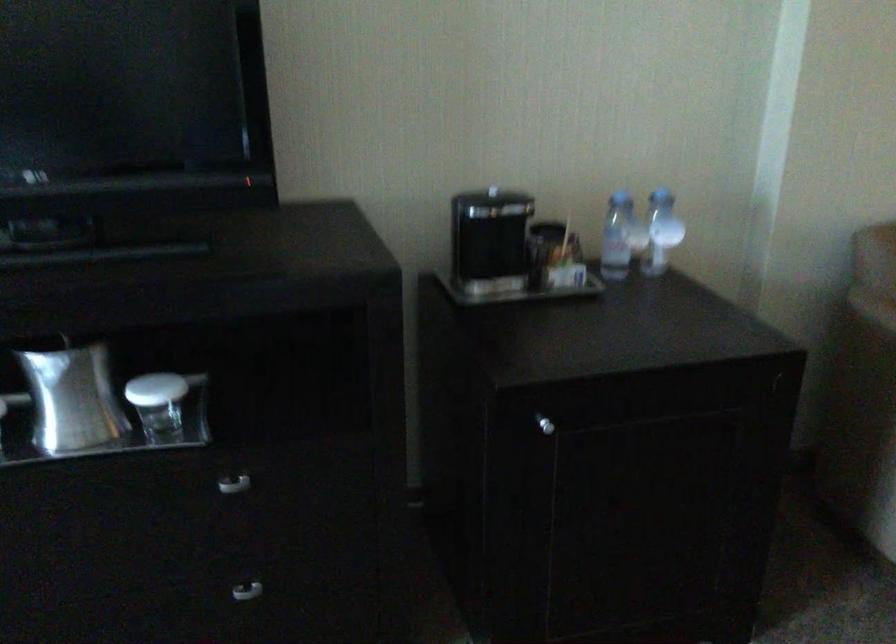
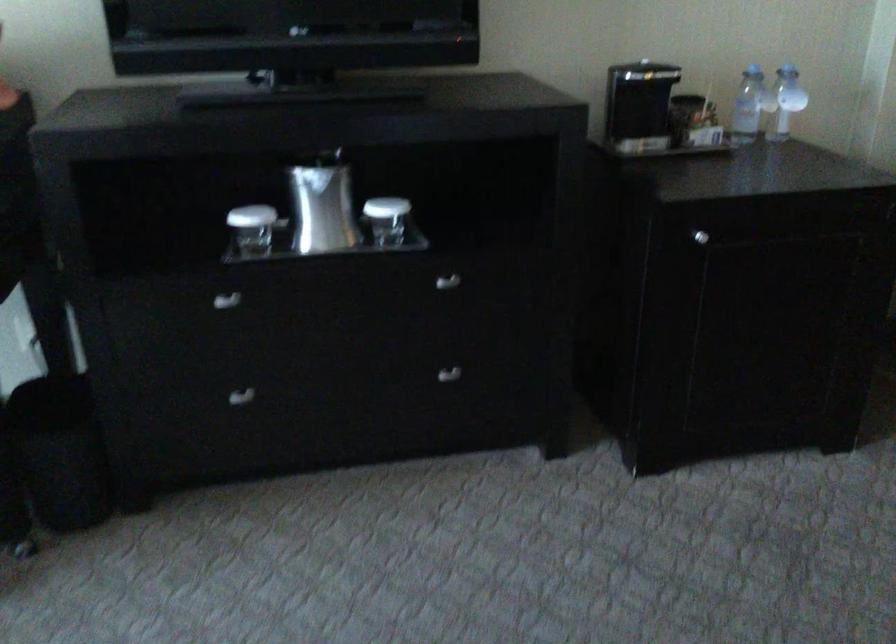
Which direction would the cameraman need to move to produce the second image?

The cameraman walked toward left, backward.